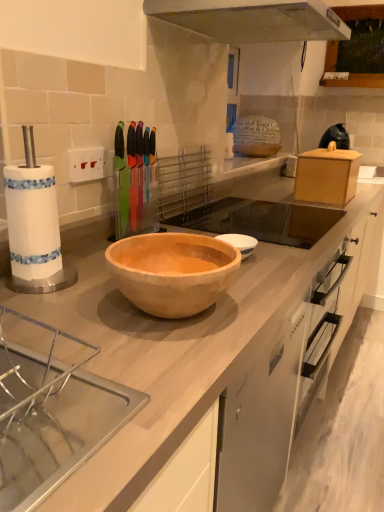
Question: Is the position of wooden bowl at center, which ranks as the first sink in back-to-front order, more distant than that of black plastic kettle at upper right?

Choices:
 (A) yes
 (B) no

Answer: (B)

Question: Is wooden bowl at center, arranged as the first sink when viewed from the top, wider than black plastic kettle at upper right?

Choices:
 (A) no
 (B) yes

Answer: (B)

Question: From the image's perspective, is wooden bowl at center, the first sink in the right-to-left sequence, on top of black plastic kettle at upper right?

Choices:
 (A) no
 (B) yes

Answer: (A)

Question: Is wooden bowl at center, the 2th sink from the left, thinner than black plastic kettle at upper right?

Choices:
 (A) no
 (B) yes

Answer: (A)

Question: Can black plastic kettle at upper right be found inside wooden bowl at center, which ranks as the first sink in back-to-front order?

Choices:
 (A) no
 (B) yes

Answer: (A)

Question: From a real-world perspective, does wooden bowl at center, arranged as the first sink when viewed from the top, sit lower than black plastic kettle at upper right?

Choices:
 (A) no
 (B) yes

Answer: (B)

Question: Does black plastic kettle at upper right appear on the left side of wooden bowl at center, which ranks as the first sink in back-to-front order?

Choices:
 (A) no
 (B) yes

Answer: (A)

Question: From the image's perspective, does black plastic kettle at upper right appear higher than wooden bowl at center, the 2th sink from the left?

Choices:
 (A) no
 (B) yes

Answer: (B)

Question: From a real-world perspective, does black plastic kettle at upper right stand above wooden bowl at center, the second sink from the front?

Choices:
 (A) no
 (B) yes

Answer: (B)

Question: Is black plastic kettle at upper right further to camera compared to wooden bowl at center, arranged as the first sink when viewed from the top?

Choices:
 (A) no
 (B) yes

Answer: (B)

Question: Is black plastic kettle at upper right positioned beyond the bounds of wooden bowl at center, the 2th sink from the left?

Choices:
 (A) yes
 (B) no

Answer: (A)

Question: Is black plastic kettle at upper right thinner than wooden bowl at center, the second sink from the front?

Choices:
 (A) no
 (B) yes

Answer: (B)

Question: Is clear acrylic sink at lower left, marked as the 1th sink in a front-to-back arrangement, far from wooden bowl at center, acting as the second sink starting from the bottom?

Choices:
 (A) no
 (B) yes

Answer: (A)